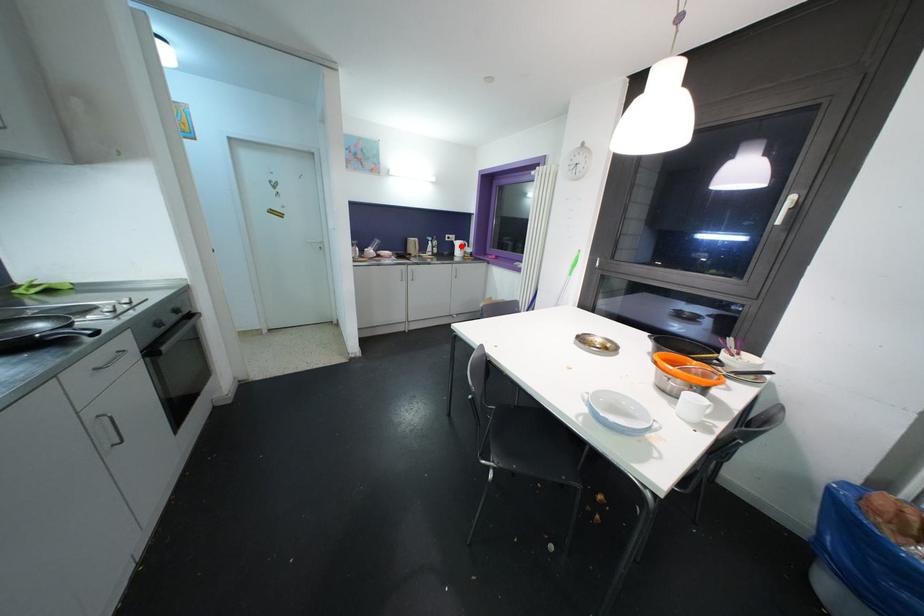
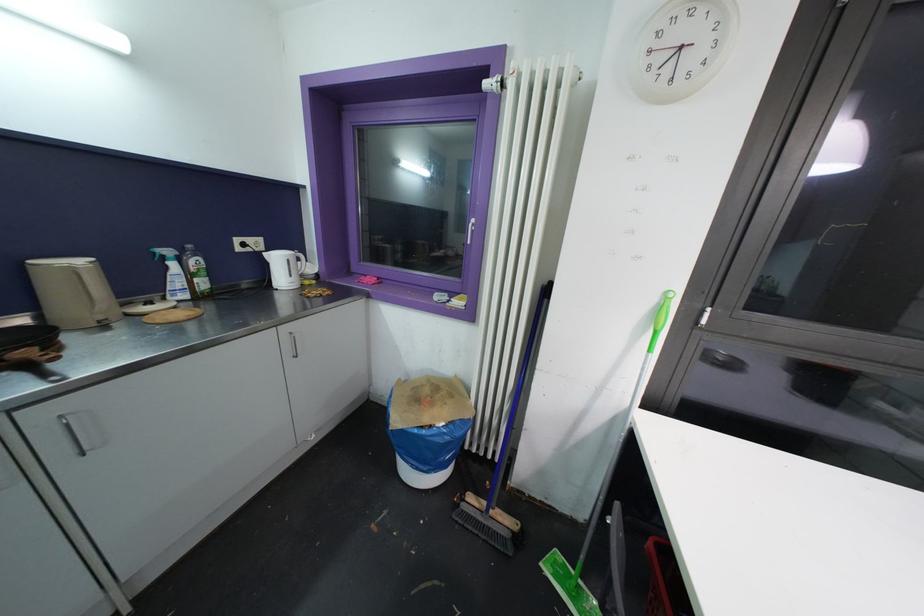
In the second image, find the point that corresponds to the highlighted location in the first image.

(281, 262)